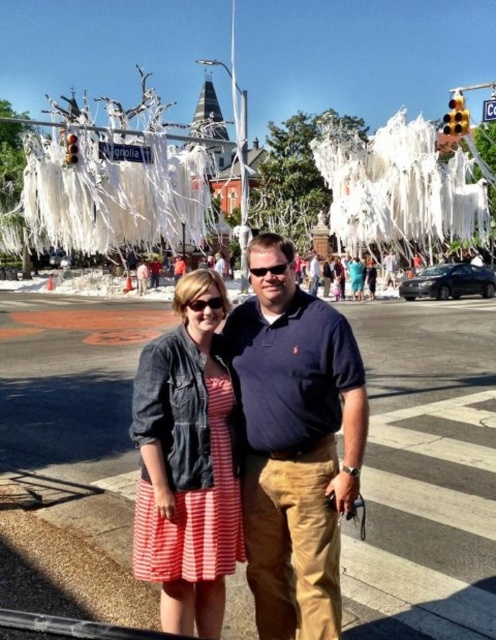
Between dark blue cotton polo shirt at center and striped cotton dress at center, which one appears on the left side from the viewer's perspective?

striped cotton dress at center is more to the left.

Is point (310, 630) less distant than point (201, 620)?

Yes, point (310, 630) is closer to viewer.

Identify the location of dark blue cotton polo shirt at center. This screenshot has height=640, width=496. (295, 442).